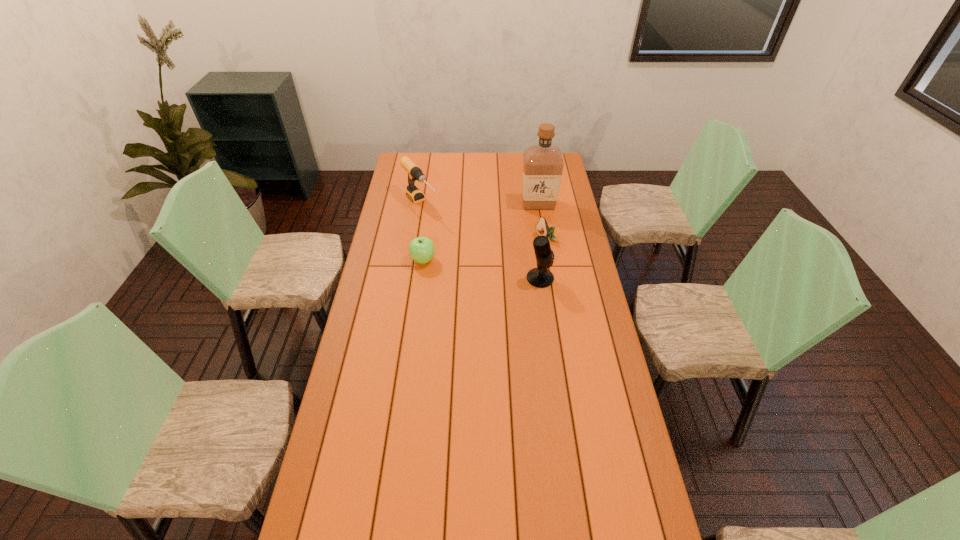
Locate an element on the screen. Image resolution: width=960 pixels, height=540 pixels. avocado that is at the right edge is located at coordinates (542, 228).

Find the location of a particular element. vacant space at the far edge is located at coordinates (446, 167).

In the image, there is a desktop. Where is `vacant space at the left edge`? This screenshot has width=960, height=540. vacant space at the left edge is located at coordinates pyautogui.click(x=410, y=207).

In the image, there is a desktop. Where is `vacant space at the right edge`? The width and height of the screenshot is (960, 540). vacant space at the right edge is located at coordinates (564, 236).

The height and width of the screenshot is (540, 960). I want to click on vacant space at the near right corner of the desktop, so click(652, 524).

At what (x,y) coordinates should I click in order to perform the action: click on free area in between the drill and the tallest object. Please return your answer as a coordinate pair (x, y). Looking at the image, I should click on (480, 204).

The image size is (960, 540). I want to click on vacant space in between the tallest object and the drill, so click(x=480, y=204).

Locate an element on the screen. free spot between the microphone and the apple is located at coordinates (482, 269).

In order to click on vacant point located between the microphone and the apple in this screenshot , I will do `click(482, 269)`.

You are a GUI agent. You are given a task and a screenshot of the screen. Output one action in this format:
    pyautogui.click(x=<x>, y=<y>)
    Task: Click on the vacant space that is in between the apple and the liquor
    This screenshot has height=540, width=960.
    Given the screenshot: What is the action you would take?
    pyautogui.click(x=481, y=232)